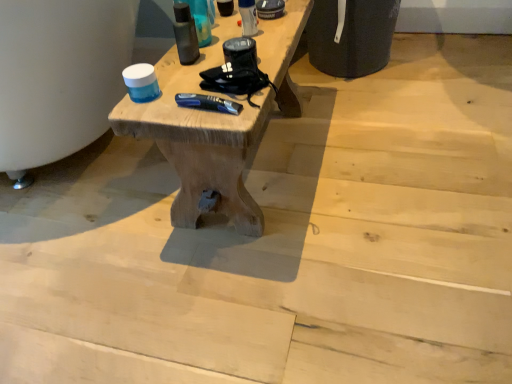
Where is `free point above wooden table at center (from a real-world perspective)`? free point above wooden table at center (from a real-world perspective) is located at coordinates (224, 40).